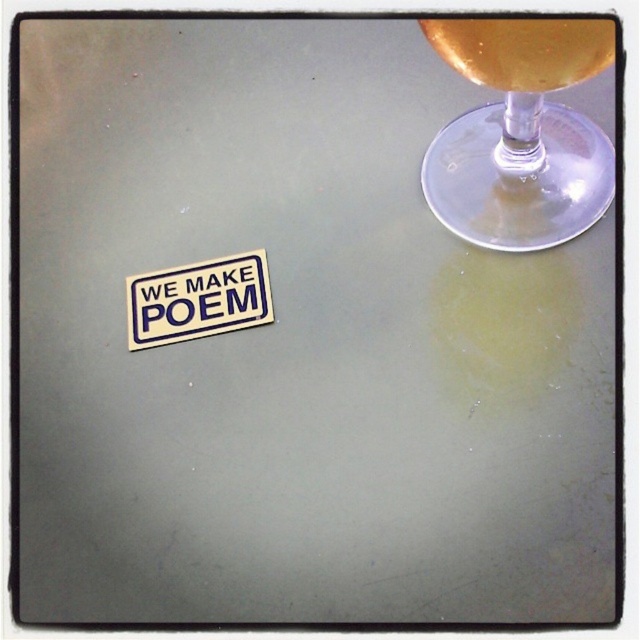
Is transparent glass wine glass at upper right further to camera compared to white paper sticker at lower left?

No, transparent glass wine glass at upper right is in front of white paper sticker at lower left.

Image resolution: width=640 pixels, height=640 pixels. I want to click on transparent glass wine glass at upper right, so click(x=520, y=132).

Is transparent glass wine glass at upper right to the right of translucent glass at upper right from the viewer's perspective?

Yes, transparent glass wine glass at upper right is to the right of translucent glass at upper right.

Describe the element at coordinates (520, 132) in the screenshot. I see `transparent glass wine glass at upper right` at that location.

The height and width of the screenshot is (640, 640). I want to click on transparent glass wine glass at upper right, so click(520, 132).

Is point (568, 65) positioned behind point (266, 307)?

No, it is not.

Between translucent glass at upper right and white paper sticker at lower left, which one appears on the right side from the viewer's perspective?

translucent glass at upper right

Is point (554, 80) positioned after point (224, 294)?

No, (554, 80) is in front of (224, 294).

At what (x,y) coordinates should I click in order to perform the action: click on translucent glass at upper right. Please return your answer as a coordinate pair (x, y). Looking at the image, I should click on (524, 51).